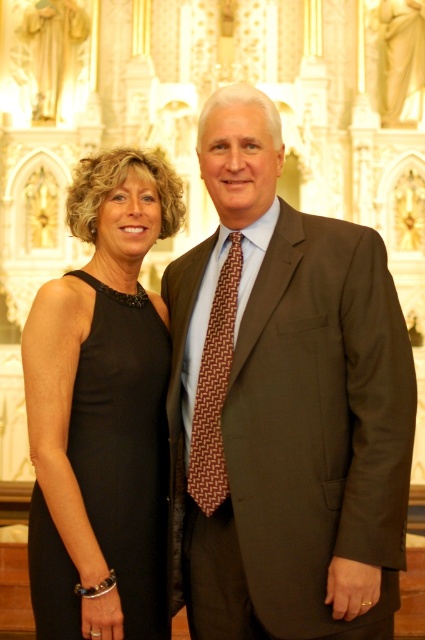
Describe the element at coordinates (283, 404) in the screenshot. This screenshot has width=425, height=640. I see `brown textured suit at center` at that location.

Who is more distant from viewer, (235, 387) or (223, 396)?

Point (223, 396)

Where is `brown textured suit at center`? The image size is (425, 640). brown textured suit at center is located at coordinates (283, 404).

Is brown textured suit at center smaller than black satin dress at left?

Incorrect, brown textured suit at center is not smaller in size than black satin dress at left.

Is brown textured suit at center taller than black satin dress at left?

Correct, brown textured suit at center is much taller as black satin dress at left.

Measure the distance between point (342,400) and camera.

They are 35.02 meters apart.

The height and width of the screenshot is (640, 425). What are the coordinates of `brown textured suit at center` in the screenshot? It's located at (283, 404).

Who is positioned more to the left, black satin dress at left or brown woven tie at center?

Positioned to the left is black satin dress at left.

Can you confirm if black satin dress at left is wider than brown woven tie at center?

Yes.

Who is more forward, (x=82, y=365) or (x=223, y=458)?

Point (x=223, y=458) is in front.

This screenshot has height=640, width=425. Find the location of `black satin dress at left`. black satin dress at left is located at coordinates (124, 449).